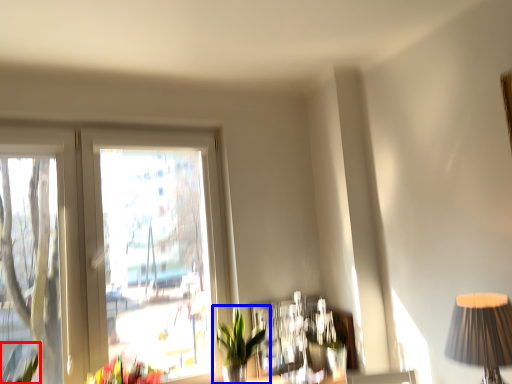
Question: Which object is closer to the camera taking this photo, plant (highlighted by a red box) or houseplant (highlighted by a blue box)?

Choices:
 (A) plant
 (B) houseplant

Answer: (A)